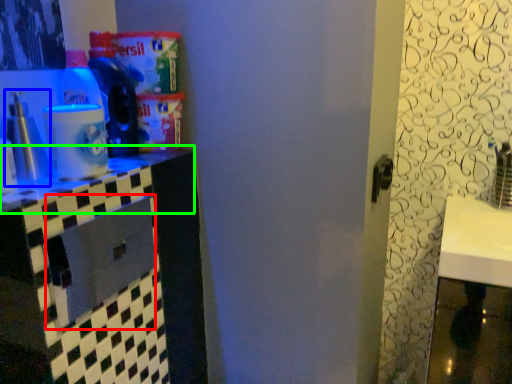
Question: Which object is the closest to the drawer (highlighted by a red box)? Choose among these: bottle (highlighted by a blue box) or counter top (highlighted by a green box).

Choices:
 (A) bottle
 (B) counter top

Answer: (B)